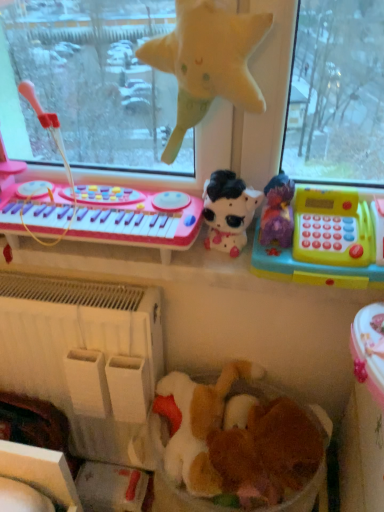
Question: Which direction should I rotate to look at fuzzy brown teddy bear at center, which appears as the fifth toy when viewed from the top, — up or down?

Choices:
 (A) up
 (B) down

Answer: (B)

Question: Which direction should I rotate to look at plush black and white cow at center, arranged as the 2th toy when viewed from the top, — up or down?

Choices:
 (A) up
 (B) down

Answer: (A)

Question: Can white plastic radiator at lower left be found inside plush black and white cow at center, arranged as the 2th toy when viewed from the top?

Choices:
 (A) yes
 (B) no

Answer: (B)

Question: Can you confirm if plush black and white cow at center, positioned as the fourth toy in bottom-to-top order, is bigger than white plastic radiator at lower left?

Choices:
 (A) no
 (B) yes

Answer: (A)

Question: Is plush black and white cow at center, arranged as the 2th toy when viewed from the top, positioned before white plastic radiator at lower left?

Choices:
 (A) yes
 (B) no

Answer: (A)

Question: Can you confirm if plush black and white cow at center, positioned as the fourth toy in bottom-to-top order, is taller than white plastic radiator at lower left?

Choices:
 (A) no
 (B) yes

Answer: (A)

Question: Could you tell me if plush black and white cow at center, arranged as the 2th toy when viewed from the top, is facing white plastic radiator at lower left?

Choices:
 (A) yes
 (B) no

Answer: (B)

Question: Is white plastic radiator at lower left at the back of plush black and white cow at center, positioned as the fourth toy in bottom-to-top order?

Choices:
 (A) yes
 (B) no

Answer: (B)

Question: Does yellow plastic cash register at right, the third toy in the top-to-bottom sequence, have a smaller size compared to pink plastic musical keyboard at left?

Choices:
 (A) yes
 (B) no

Answer: (A)

Question: Can you confirm if yellow plastic cash register at right, the third toy in the top-to-bottom sequence, is bigger than pink plastic musical keyboard at left?

Choices:
 (A) yes
 (B) no

Answer: (B)

Question: From a real-world perspective, does yellow plastic cash register at right, which is counted as the 3th toy, starting from the bottom, sit lower than pink plastic musical keyboard at left?

Choices:
 (A) yes
 (B) no

Answer: (B)

Question: From the image's perspective, would you say yellow plastic cash register at right, the third toy in the top-to-bottom sequence, is shown under pink plastic musical keyboard at left?

Choices:
 (A) no
 (B) yes

Answer: (B)

Question: Is pink plastic musical keyboard at left located within yellow plastic cash register at right, the third toy in the top-to-bottom sequence?

Choices:
 (A) yes
 (B) no

Answer: (B)

Question: Is yellow plastic cash register at right, which is counted as the 3th toy, starting from the bottom, far from pink plastic musical keyboard at left?

Choices:
 (A) no
 (B) yes

Answer: (A)

Question: Can you confirm if fluffy white stuffed animal at center, which is the fourth toy from top to bottom, is shorter than pink plastic musical keyboard at left?

Choices:
 (A) yes
 (B) no

Answer: (B)